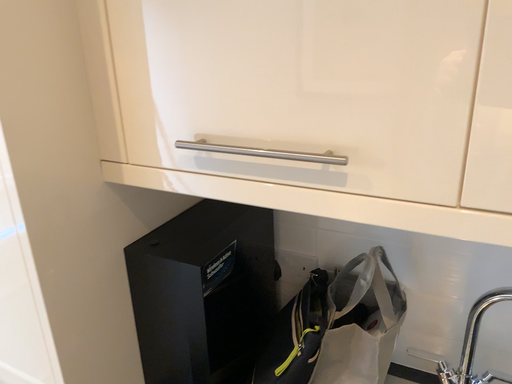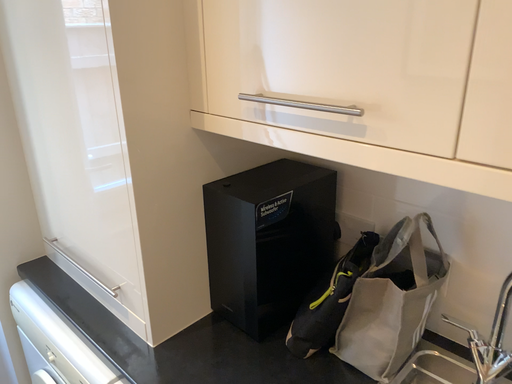
Question: How did the camera likely rotate when shooting the video?

Choices:
 (A) rotated left
 (B) rotated right

Answer: (A)